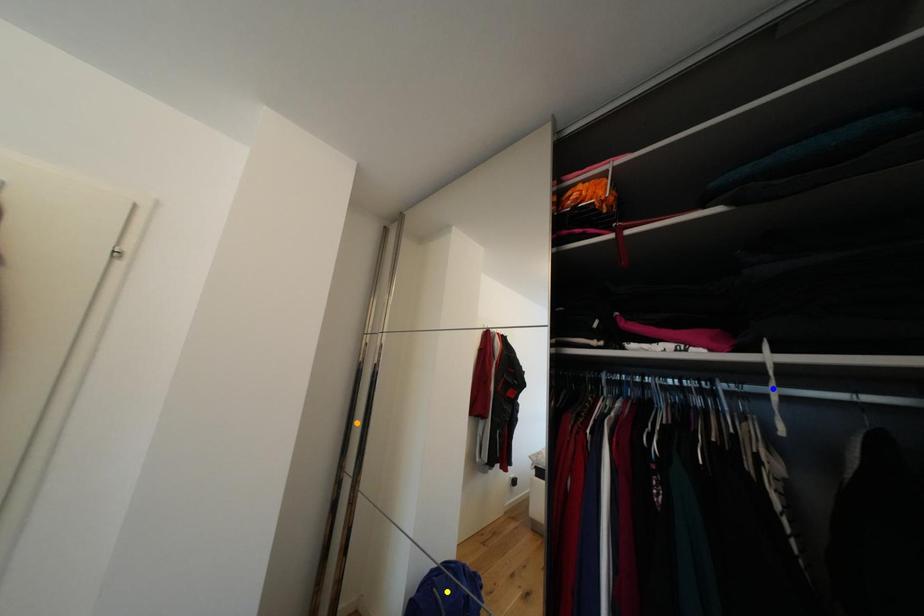
In the scene shown: Order these from nearest to farthest:
- blue point
- orange point
- yellow point

blue point, yellow point, orange point